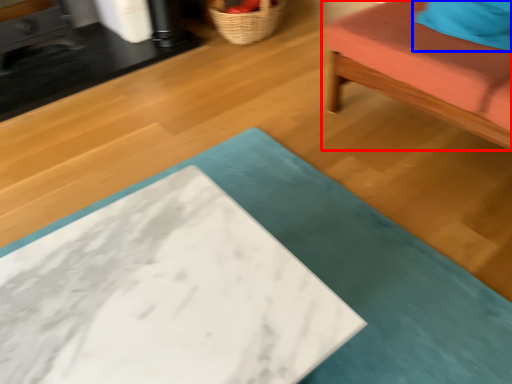
Question: Which of the following is the farthest to the observer, furniture (highlighted by a red box) or pillow (highlighted by a blue box)?

Choices:
 (A) furniture
 (B) pillow

Answer: (B)